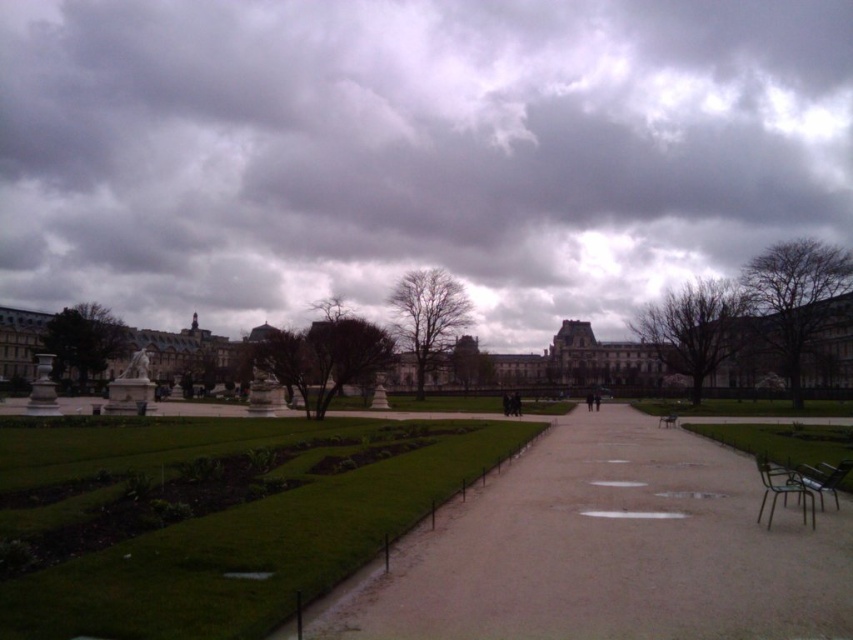
Is cloudy sky at upper center to the left of wooden park bench at center from the viewer's perspective?

Indeed, cloudy sky at upper center is positioned on the left side of wooden park bench at center.

Can you confirm if cloudy sky at upper center is smaller than wooden park bench at center?

Incorrect, cloudy sky at upper center is not smaller in size than wooden park bench at center.

At what (x,y) coordinates should I click in order to perform the action: click on cloudy sky at upper center. Please return your answer as a coordinate pair (x, y). This screenshot has height=640, width=853. Looking at the image, I should click on (412, 150).

Between green grass at center and wooden park bench at center, which one has less height?

wooden park bench at center

Who is more forward, (352,508) or (666,412)?

Point (352,508) is in front.

Between point (173, 449) and point (660, 417), which one is positioned in front?

Positioned in front is point (173, 449).

Where is `green grass at center`? green grass at center is located at coordinates (209, 515).

Who is positioned more to the right, cloudy sky at upper center or gray concrete pathway at center?

gray concrete pathway at center

The height and width of the screenshot is (640, 853). Describe the element at coordinates (412, 150) in the screenshot. I see `cloudy sky at upper center` at that location.

Is point (20, 280) farther from viewer compared to point (344, 595)?

Yes.

This screenshot has width=853, height=640. Find the location of `cloudy sky at upper center`. cloudy sky at upper center is located at coordinates (412, 150).